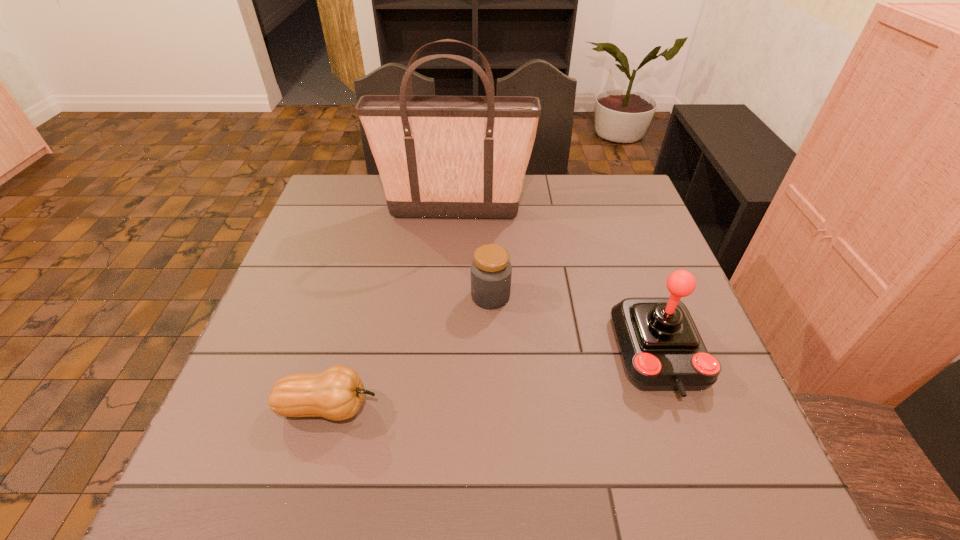
The height and width of the screenshot is (540, 960). I want to click on vacant space that's between the second tallest object and the shortest object, so click(x=493, y=380).

Choose which object is the third nearest neighbor to the farthest object. Please provide its 2D coordinates. Your answer should be formatted as a tuple, i.e. [(x, y)], where the tuple contains the x and y coordinates of a point satisfying the conditions above.

[(336, 394)]

At what (x,y) coordinates should I click in order to perform the action: click on object that is the third closest to the farthest object. Please return your answer as a coordinate pair (x, y). Looking at the image, I should click on (336, 394).

Find the location of `vacant point that satisfies the following two spatial constraints: 1. on the base of the second tallest object; 2. on the stem side of the shortest object`. vacant point that satisfies the following two spatial constraints: 1. on the base of the second tallest object; 2. on the stem side of the shortest object is located at coordinates (678, 407).

The width and height of the screenshot is (960, 540). Identify the location of free location that satisfies the following two spatial constraints: 1. on the base of the joystick; 2. on the stem side of the gourd. (678, 407).

Locate an element on the screen. The width and height of the screenshot is (960, 540). vacant region that satisfies the following two spatial constraints: 1. on the base of the joystick; 2. on the stem side of the gourd is located at coordinates (678, 407).

This screenshot has height=540, width=960. I want to click on free location that satisfies the following two spatial constraints: 1. on the front side of the shopping bag; 2. on the stem side of the gourd, so click(440, 407).